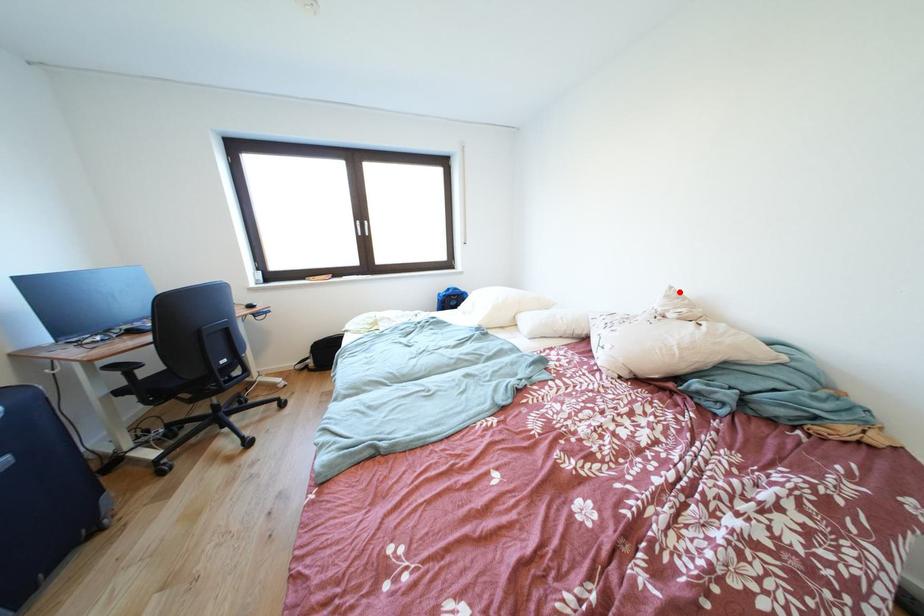
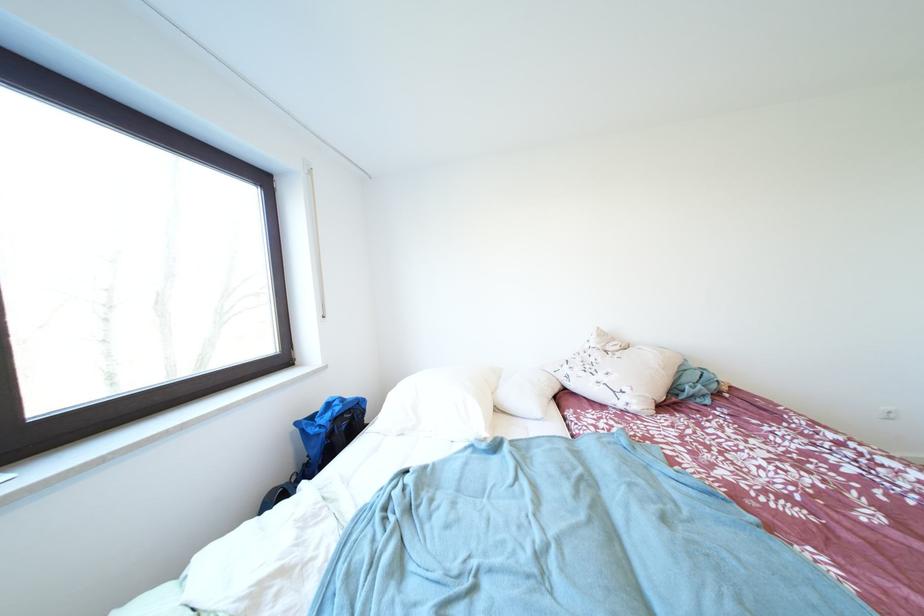
Find the pixel in the second image that matches the highlighted location in the first image.

(606, 333)